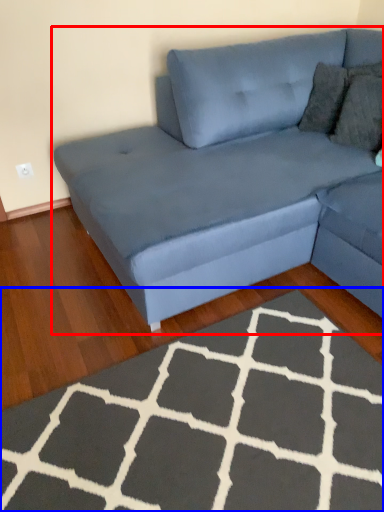
Question: Which point is further to the camera, studio couch (highlighted by a red box) or doormat (highlighted by a blue box)?

Choices:
 (A) studio couch
 (B) doormat

Answer: (A)